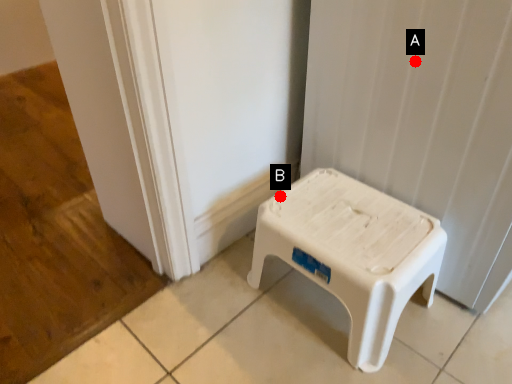
Question: Two points are circled on the image, labeled by A and B beside each circle. Among these points, which one is nearest to the camera?

Choices:
 (A) A is closer
 (B) B is closer

Answer: (A)